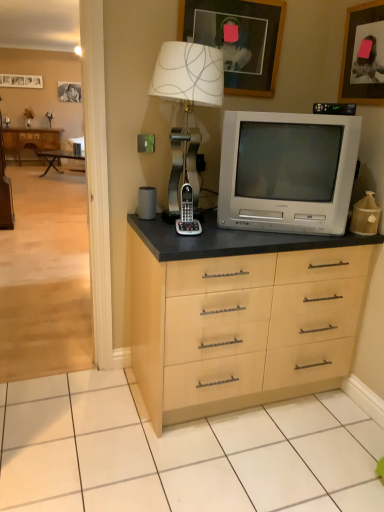
Question: From a real-world perspective, is gray plastic phone at center on top of wooden photo frame at upper left, the third picture frame positioned from the front?

Choices:
 (A) yes
 (B) no

Answer: (B)

Question: Is gray plastic phone at center positioned beyond the bounds of wooden photo frame at upper left, positioned as the 1th picture frame in back-to-front order?

Choices:
 (A) no
 (B) yes

Answer: (B)

Question: Does gray plastic phone at center have a greater width compared to wooden photo frame at upper left, which is the 1th picture frame in left-to-right order?

Choices:
 (A) no
 (B) yes

Answer: (B)

Question: Is gray plastic phone at center looking in the opposite direction of wooden photo frame at upper left, marked as the 1th picture frame in a top-to-bottom arrangement?

Choices:
 (A) yes
 (B) no

Answer: (B)

Question: Is gray plastic phone at center shorter than wooden photo frame at upper left, the third picture frame positioned from the front?

Choices:
 (A) no
 (B) yes

Answer: (B)

Question: Would you say gray plastic phone at center is a long distance from wooden photo frame at upper left, marked as the 1th picture frame in a top-to-bottom arrangement?

Choices:
 (A) yes
 (B) no

Answer: (A)

Question: From a real-world perspective, is gray plastic phone at center over matte gray speaker at left?

Choices:
 (A) yes
 (B) no

Answer: (A)

Question: Can you confirm if gray plastic phone at center is smaller than matte gray speaker at left?

Choices:
 (A) yes
 (B) no

Answer: (B)

Question: Considering the relative positions of gray plastic phone at center and matte gray speaker at left in the image provided, is gray plastic phone at center behind matte gray speaker at left?

Choices:
 (A) no
 (B) yes

Answer: (A)

Question: Can you confirm if gray plastic phone at center is taller than matte gray speaker at left?

Choices:
 (A) yes
 (B) no

Answer: (A)

Question: From the image's perspective, is gray plastic phone at center under matte gray speaker at left?

Choices:
 (A) no
 (B) yes

Answer: (B)

Question: Could you tell me if gray plastic phone at center is turned towards matte gray speaker at left?

Choices:
 (A) no
 (B) yes

Answer: (A)

Question: Considering the relative sizes of wooden photo frame at upper left, positioned as the 1th picture frame in back-to-front order, and wooden picture frame at upper center, which ranks as the 2th picture frame in right-to-left order, in the image provided, is wooden photo frame at upper left, positioned as the 1th picture frame in back-to-front order, shorter than wooden picture frame at upper center, which ranks as the 2th picture frame in right-to-left order,?

Choices:
 (A) yes
 (B) no

Answer: (A)